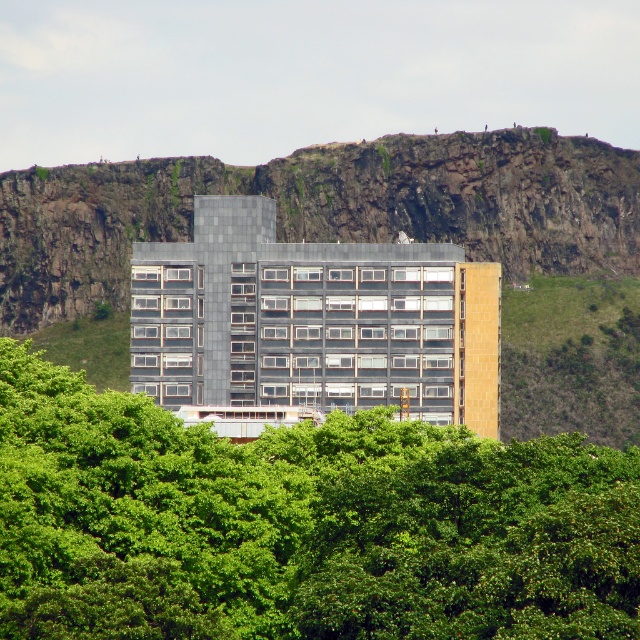
Is point (554, 570) farther from viewer compared to point (228, 205)?

No, (554, 570) is in front of (228, 205).

Between point (449, 483) and point (195, 259), which one is positioned behind?

The point (195, 259) is more distant.

Which is in front, point (32, 394) or point (262, 208)?

Point (32, 394) is more forward.

I want to click on green leafy tree at center, so click(x=300, y=525).

Is green leafy tree at center taller than rugged rock at center?

No, green leafy tree at center is not taller than rugged rock at center.

The width and height of the screenshot is (640, 640). What do you see at coordinates (300, 525) in the screenshot? I see `green leafy tree at center` at bounding box center [300, 525].

Does point (22, 627) come in front of point (454, 216)?

Yes, point (22, 627) is in front of point (454, 216).

In order to click on green leafy tree at center in this screenshot , I will do `click(300, 525)`.

Is the position of rugged rock at center more distant than that of matte glass building at center?

Yes, rugged rock at center is behind matte glass building at center.

Who is higher up, rugged rock at center or matte glass building at center?

Positioned higher is rugged rock at center.

Is point (60, 266) closer to viewer compared to point (161, 244)?

No, it is not.

At what (x,y) coordinates should I click in order to perform the action: click on rugged rock at center. Please return your answer as a coordinate pair (x, y). The image size is (640, 640). Looking at the image, I should click on (324, 209).